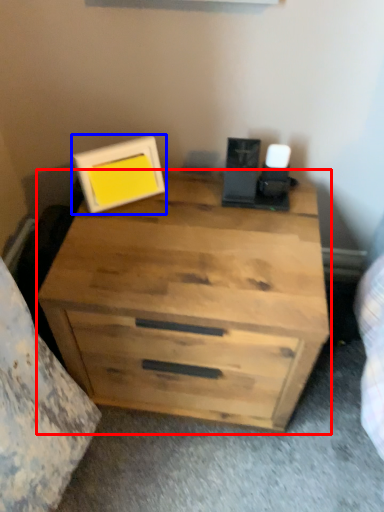
Question: Which of the following is the closest to the observer, chest of drawers (highlighted by a red box) or picture frame (highlighted by a blue box)?

Choices:
 (A) chest of drawers
 (B) picture frame

Answer: (A)